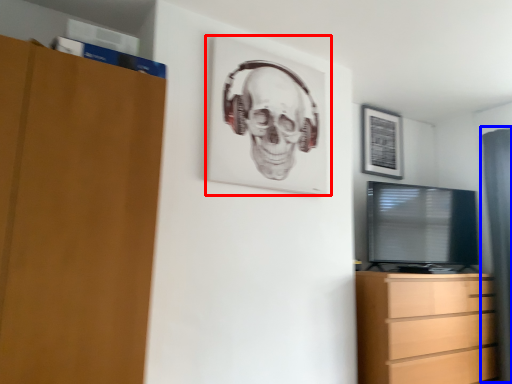
Question: Which object appears closest to the camera in this image, picture frame (highlighted by a red box) or curtain (highlighted by a blue box)?

Choices:
 (A) picture frame
 (B) curtain

Answer: (A)